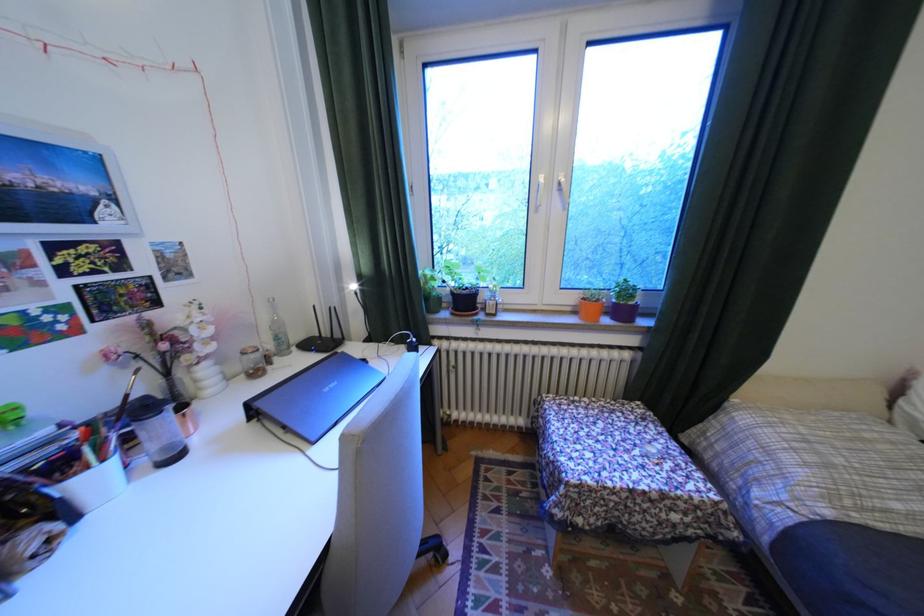
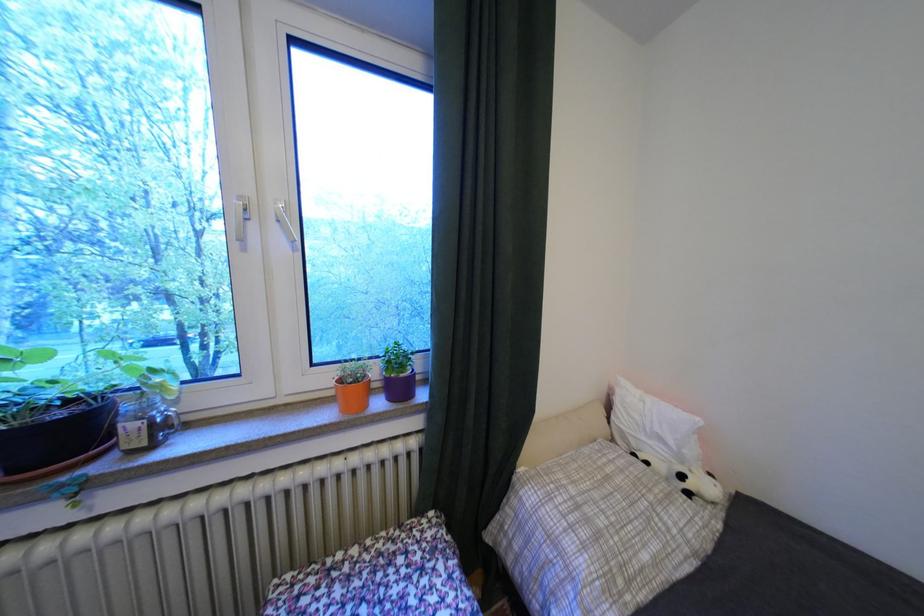
The point at (x=663, y=427) is marked in the first image. Where is the corresponding point in the second image?

(453, 565)